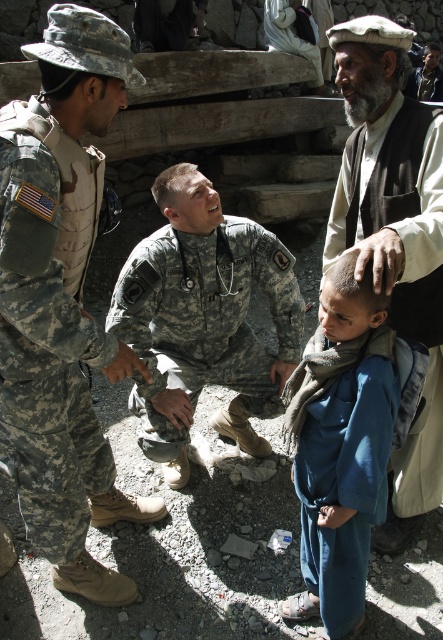
From the picture: In the scene, there are two soldiers wearing camouflage uniforms. The first is labeled as the camouflage fabric uniform at left, and the second as the camouflage uniform at center. From the perspective of someone standing in front of them, which soldier is positioned to the right?

The camouflage uniform at center is positioned to the right of the camouflage fabric uniform at left.